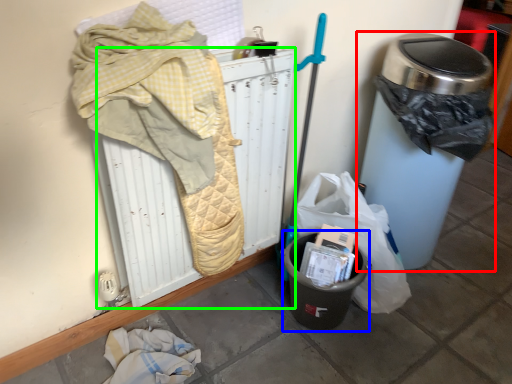
Question: Which object is the farthest from waste container (highlighted by a red box)? Choose among these: recycling bin (highlighted by a blue box) or radiator (highlighted by a green box).

Choices:
 (A) recycling bin
 (B) radiator

Answer: (B)